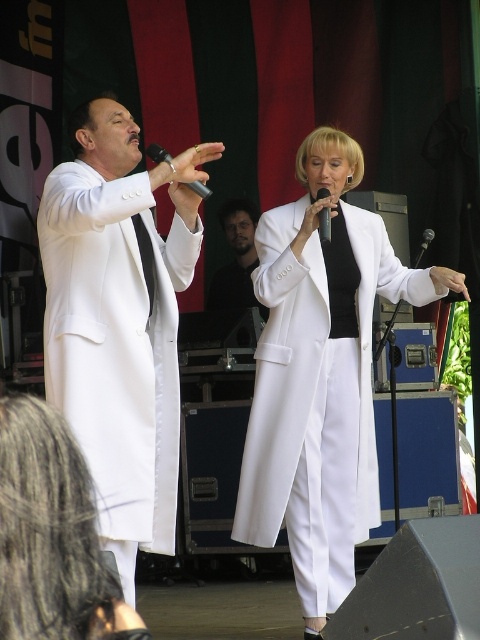
Locate an element on the screen. This screenshot has height=640, width=480. white matte coat at center is located at coordinates (317, 396).

Between white matte coat at center and black matte microphone at upper center, which one has less height?

With less height is black matte microphone at upper center.

The image size is (480, 640). I want to click on white matte coat at center, so click(317, 396).

Who is positioned more to the right, matte white coat at left or white glossy coat at center?

white glossy coat at center is more to the right.

Which is behind, point (79, 388) or point (23, 502)?

The point (79, 388) is behind.

Which is behind, point (171, 486) or point (6, 532)?

Positioned behind is point (171, 486).

Image resolution: width=480 pixels, height=640 pixels. In order to click on matte white coat at left in this screenshot , I will do `click(120, 321)`.

How far apart are white glossy coat at center and black plastic microphone at center?

A distance of 4.45 meters exists between white glossy coat at center and black plastic microphone at center.

Does white glossy coat at center appear on the right side of black plastic microphone at center?

Incorrect, white glossy coat at center is not on the right side of black plastic microphone at center.

Describe the element at coordinates (51, 536) in the screenshot. I see `white glossy coat at center` at that location.

Where is `white glossy coat at center`? The height and width of the screenshot is (640, 480). white glossy coat at center is located at coordinates (51, 536).